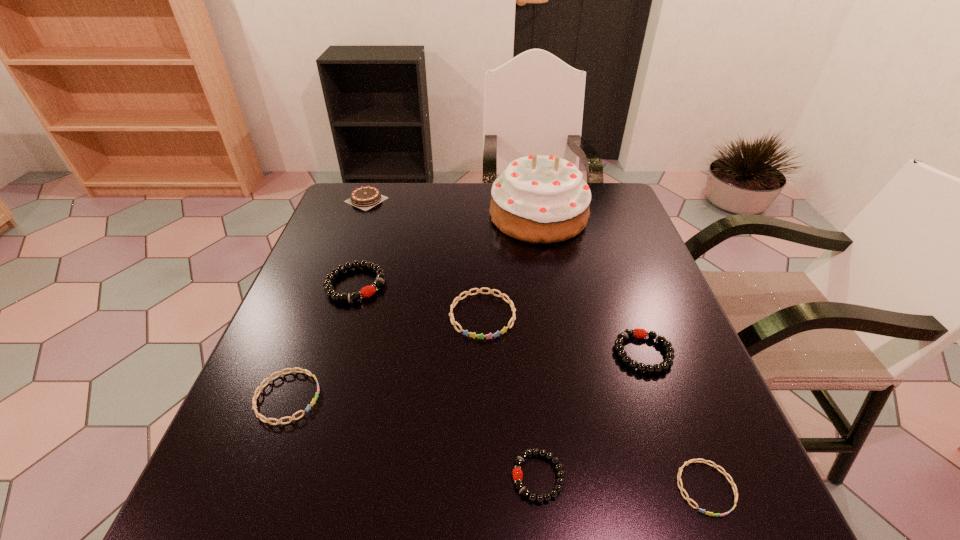
What are the coordinates of `vacant area between the second smallest blue bracelet and the shortest bracelet` in the screenshot? It's located at (496, 443).

Image resolution: width=960 pixels, height=540 pixels. What are the coordinates of `free area in between the nearest black bracelet and the second blue bracelet from left to right` in the screenshot? It's located at (511, 396).

Image resolution: width=960 pixels, height=540 pixels. In order to click on free area in between the second black bracelet from left to right and the second smallest blue bracelet in this screenshot , I will do `click(413, 437)`.

At what (x,y) coordinates should I click in order to perform the action: click on vacant region between the biggest black bracelet and the shortest object. Please return your answer as a coordinate pair (x, y). This screenshot has height=540, width=960. Looking at the image, I should click on 531,386.

Locate an element on the screen. The height and width of the screenshot is (540, 960). empty space between the second nearest black bracelet and the brown chocolate cake is located at coordinates (505, 276).

The width and height of the screenshot is (960, 540). Identify the location of blank region between the brown chocolate cake and the shortest bracelet. (536, 344).

Where is `vacant space in between the brown chocolate cake and the second smallest black bracelet`? The width and height of the screenshot is (960, 540). vacant space in between the brown chocolate cake and the second smallest black bracelet is located at coordinates (505, 276).

Identify which object is the third closest to the second black bracelet from left to right. Please provide its 2D coordinates. Your answer should be formatted as a tuple, i.e. [(x, y)], where the tuple contains the x and y coordinates of a point satisfying the conditions above.

[(480, 336)]

Find the location of a particular element. Image resolution: width=960 pixels, height=540 pixels. object that stands as the fifth closest to the farthest black bracelet is located at coordinates (517, 472).

Find the location of a particular element. The width and height of the screenshot is (960, 540). bracelet that stands as the third closest to the nearest blue bracelet is located at coordinates (480, 336).